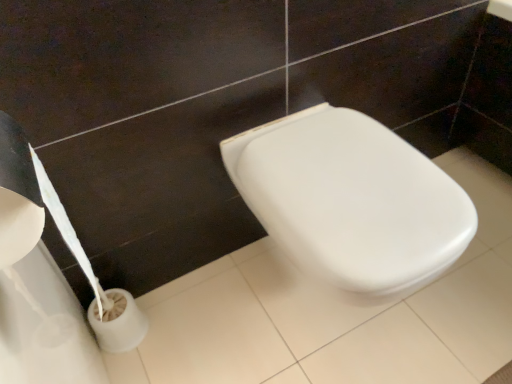
Find the location of a particular element. vacant area to the right of white glossy toilet at center is located at coordinates (474, 291).